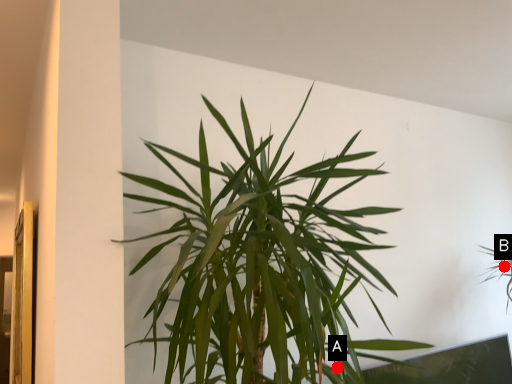
Question: Two points are circled on the image, labeled by A and B beside each circle. Which point is closer to the camera?

Choices:
 (A) A is closer
 (B) B is closer

Answer: (A)